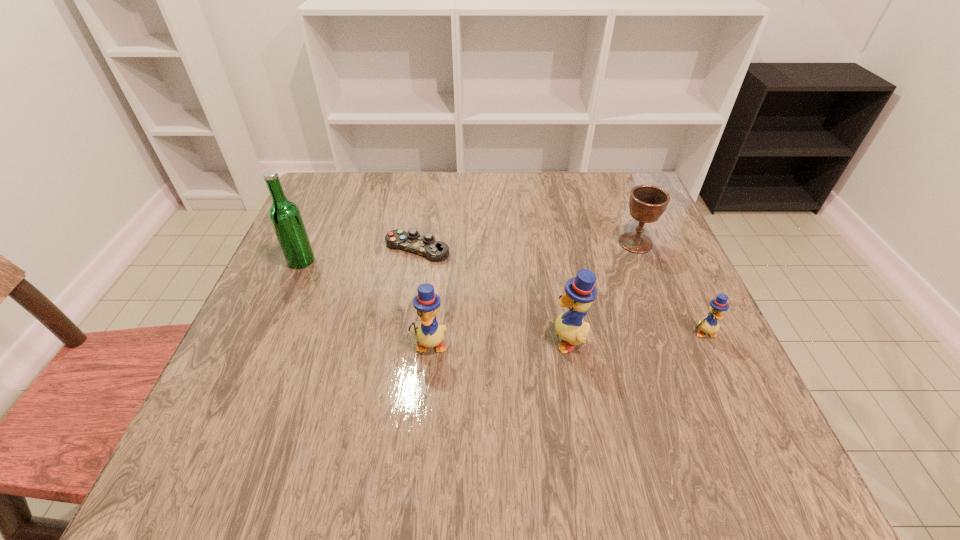
The image size is (960, 540). I want to click on vacant space that satisfies the following two spatial constraints: 1. on the face of the shortest duckling, where the monocle is placed; 2. on the face of the fourth object from left to right, where the monocle is placed, so click(x=707, y=339).